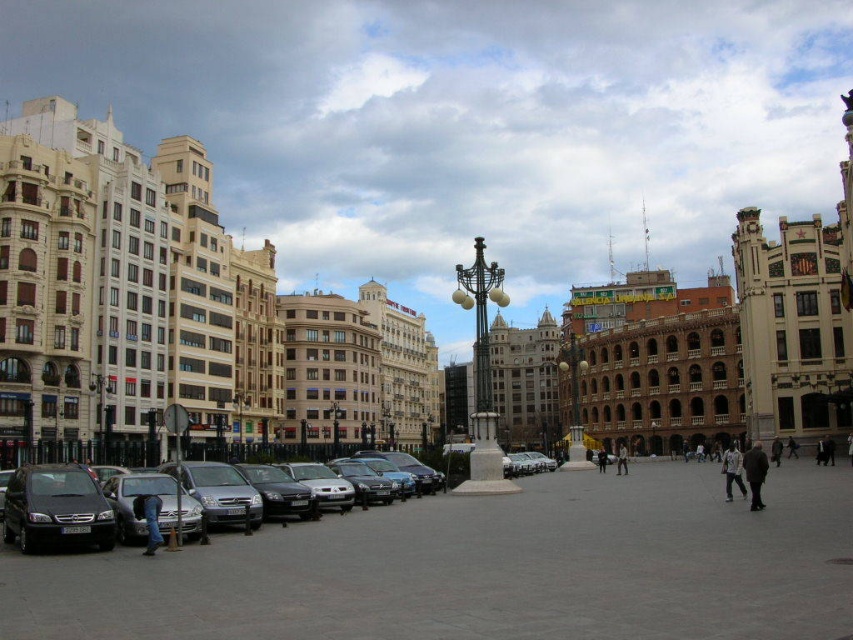
You are a photographer setting up a tripod in the urban square. You notice the jeans at lower left and the dark gray jacket at center. Which object should you adjust your camera angle to focus on if you want to capture the taller object?

The dark gray jacket at center is taller than the jeans at lower left, so you should adjust your camera angle to focus on the dark gray jacket at center to capture the taller object.

You are a delivery driver who needs to park your matte black van at left in the urban square. The parking spot is located at coordinates point 0.795, 0.067. Can you confirm if the van is already parked in the correct spot?

The matte black van at left is positioned at point [56,508], so yes, it is parked in the correct parking spot.